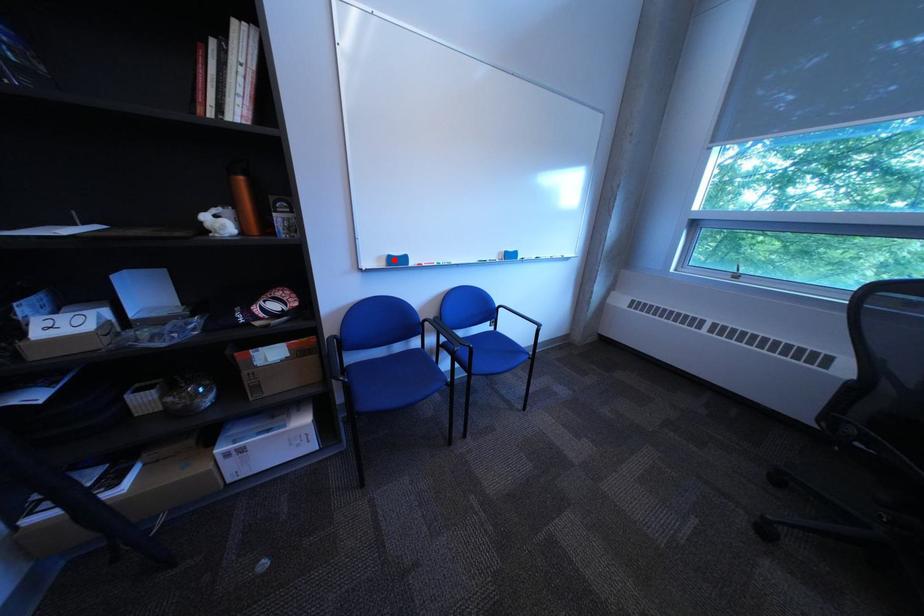
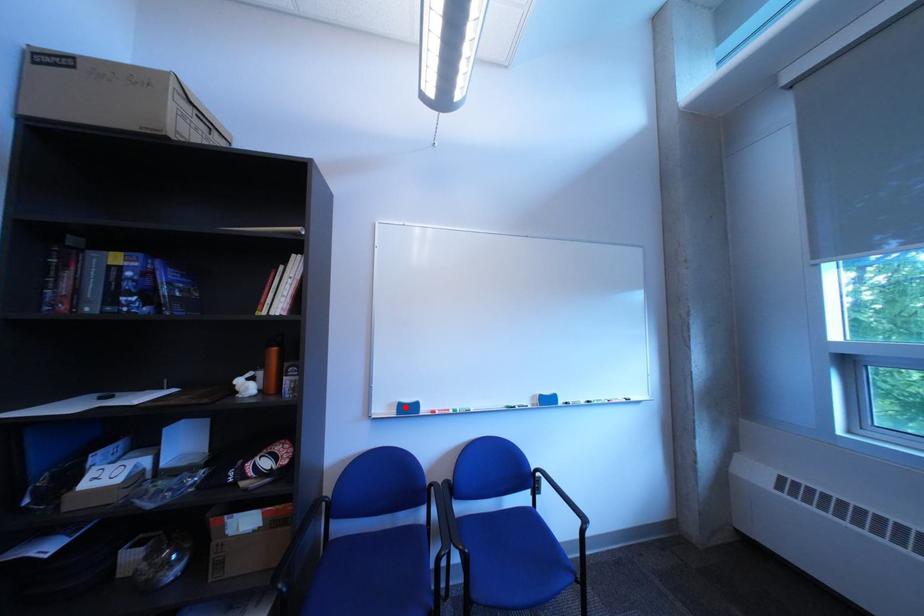
I am providing you with two images of the same scene from different viewpoints. A red point is marked on the first image and another point is marked on the second image. Is the red point in image1 aligned with the point shown in image2?

Yes